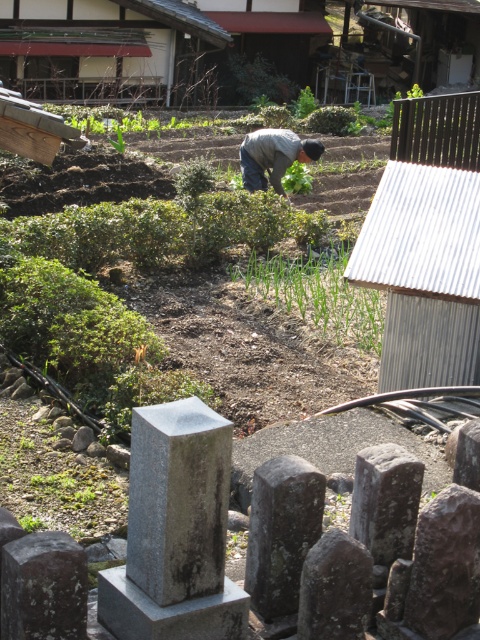
Question: Which object is closer to the camera taking this photo?

Choices:
 (A) gray fabric at center
 (B) wooden hut at upper center

Answer: (A)

Question: Which point is farther to the camera?

Choices:
 (A) wooden hut at upper center
 (B) gray fabric at center

Answer: (A)

Question: Can you confirm if wooden hut at upper center is positioned to the right of gray fabric at center?

Choices:
 (A) no
 (B) yes

Answer: (A)

Question: Is wooden hut at upper center smaller than gray fabric at center?

Choices:
 (A) no
 (B) yes

Answer: (A)

Question: Can you confirm if wooden hut at upper center is positioned below gray fabric at center?

Choices:
 (A) yes
 (B) no

Answer: (B)

Question: Which object is closer to the camera taking this photo?

Choices:
 (A) wooden hut at upper center
 (B) gray fabric at center

Answer: (B)